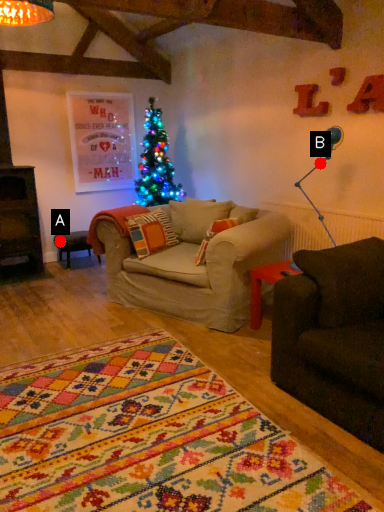
Question: Two points are circled on the image, labeled by A and B beside each circle. Which point is closer to the camera?

Choices:
 (A) A is closer
 (B) B is closer

Answer: (B)